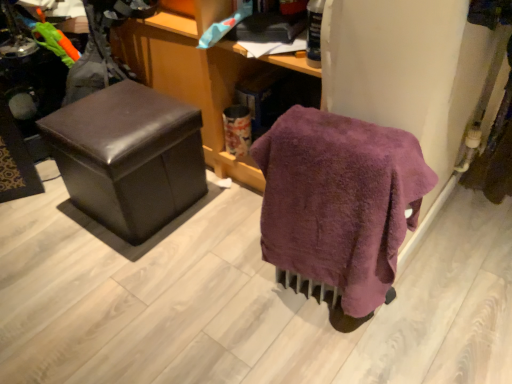
Question: From the image's perspective, is purple terry cloth towel at lower right above or below matte brown ottoman at left?

Choices:
 (A) below
 (B) above

Answer: (A)

Question: Looking at the image, does purple terry cloth towel at lower right seem bigger or smaller compared to matte brown ottoman at left?

Choices:
 (A) small
 (B) big

Answer: (A)

Question: From a real-world perspective, is purple terry cloth towel at lower right above or below matte brown ottoman at left?

Choices:
 (A) below
 (B) above

Answer: (B)

Question: Considering their positions, is matte brown ottoman at left located in front of or behind purple terry cloth towel at lower right?

Choices:
 (A) behind
 (B) front

Answer: (A)

Question: From the image's perspective, is matte brown ottoman at left above or below purple terry cloth towel at lower right?

Choices:
 (A) below
 (B) above

Answer: (B)

Question: From a real-world perspective, is matte brown ottoman at left positioned above or below purple terry cloth towel at lower right?

Choices:
 (A) below
 (B) above

Answer: (A)

Question: Does point (133, 135) appear closer or farther from the camera than point (288, 253)?

Choices:
 (A) farther
 (B) closer

Answer: (A)